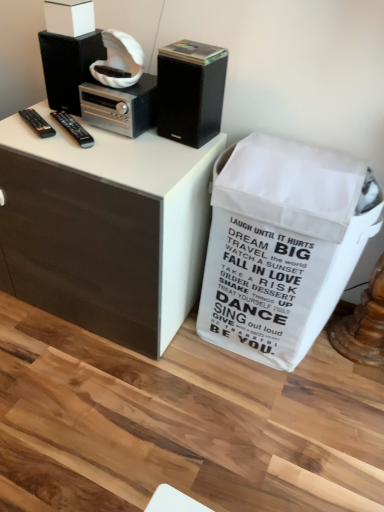
Question: Are black plastic remote at left, which is counted as the first remote control, starting from the right, and white matte box at upper left far apart?

Choices:
 (A) no
 (B) yes

Answer: (A)

Question: Considering the relative sizes of black plastic remote at left, arranged as the second remote control when viewed from the left, and white matte box at upper left in the image provided, is black plastic remote at left, arranged as the second remote control when viewed from the left, thinner than white matte box at upper left?

Choices:
 (A) no
 (B) yes

Answer: (B)

Question: Can you confirm if black plastic remote at left, which is counted as the first remote control, starting from the right, is bigger than white matte box at upper left?

Choices:
 (A) yes
 (B) no

Answer: (B)

Question: Is black plastic remote at left, which is counted as the first remote control, starting from the right, looking in the opposite direction of white matte box at upper left?

Choices:
 (A) yes
 (B) no

Answer: (B)

Question: From a real-world perspective, is black plastic remote at left, which is counted as the first remote control, starting from the right, positioned over white matte box at upper left based on gravity?

Choices:
 (A) no
 (B) yes

Answer: (A)

Question: In the image, is white matte trash bin/can at lower right positioned in front of or behind black matte speaker at upper left, which is the second loudspeaker from right to left?

Choices:
 (A) front
 (B) behind

Answer: (A)

Question: In terms of width, does white matte trash bin/can at lower right look wider or thinner when compared to black matte speaker at upper left, which is the second loudspeaker from right to left?

Choices:
 (A) thin
 (B) wide

Answer: (B)

Question: Based on their sizes in the image, would you say white matte trash bin/can at lower right is bigger or smaller than black matte speaker at upper left, which is the second loudspeaker from right to left?

Choices:
 (A) big
 (B) small

Answer: (A)

Question: Considering the positions of white matte trash bin/can at lower right and black matte speaker at upper left, which is the second loudspeaker from right to left, in the image, is white matte trash bin/can at lower right taller or shorter than black matte speaker at upper left, which is the second loudspeaker from right to left,?

Choices:
 (A) tall
 (B) short

Answer: (A)

Question: From the image's perspective, is silver metallic stereo at upper center positioned above or below black plastic remote at left, arranged as the second remote control when viewed from the left?

Choices:
 (A) above
 (B) below

Answer: (A)

Question: Is point (115, 92) positioned closer to the camera than point (64, 122)?

Choices:
 (A) farther
 (B) closer

Answer: (B)

Question: Looking at their shapes, would you say silver metallic stereo at upper center is wider or thinner than black plastic remote at left, arranged as the second remote control when viewed from the left?

Choices:
 (A) thin
 (B) wide

Answer: (B)

Question: In terms of height, does silver metallic stereo at upper center look taller or shorter compared to black plastic remote at left, which is counted as the first remote control, starting from the right?

Choices:
 (A) tall
 (B) short

Answer: (A)

Question: From a real-world perspective, is black plastic remote at left, arranged as the first remote control when viewed from the left, physically located above or below white matte box at upper left?

Choices:
 (A) below
 (B) above

Answer: (A)

Question: From the image's perspective, is black plastic remote at left, the 2th remote control from the right, above or below white matte box at upper left?

Choices:
 (A) below
 (B) above

Answer: (A)